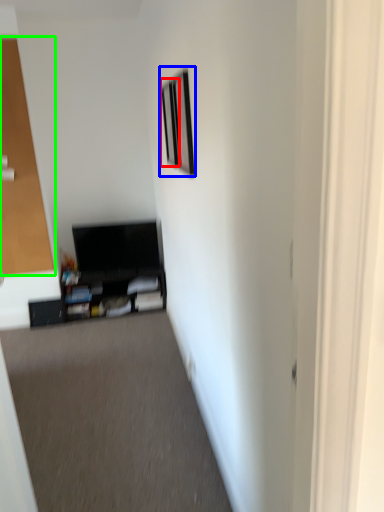
Question: Considering the real-world distances, which object is closest to picture frame (highlighted by a red box)? picture frame (highlighted by a blue box) or glass door (highlighted by a green box).

Choices:
 (A) picture frame
 (B) glass door

Answer: (A)